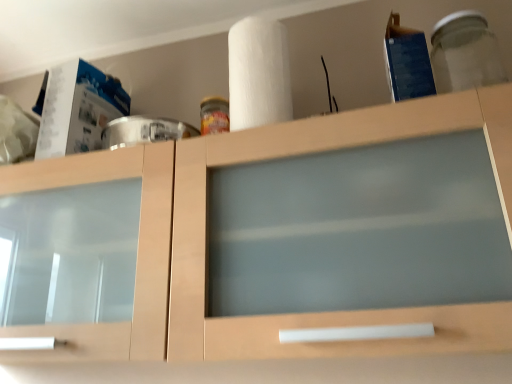
This screenshot has width=512, height=384. What do you see at coordinates (258, 74) in the screenshot?
I see `white matte paper towel at upper center` at bounding box center [258, 74].

Describe the element at coordinates (270, 238) in the screenshot. I see `matte wood cabinet at center` at that location.

The height and width of the screenshot is (384, 512). What are the coordinates of `white matte paper towel at upper center` in the screenshot? It's located at (258, 74).

From the image's perspective, is matte wood cabinet at center located above white matte paper towel at upper center?

No, from the image's perspective, matte wood cabinet at center is not over white matte paper towel at upper center.

Does point (158, 315) lie behind point (260, 87)?

No, it is not.

Is matte wood cabinet at center thinner than white matte paper towel at upper center?

No, matte wood cabinet at center is not thinner than white matte paper towel at upper center.

From a real-world perspective, which object stands above the other?

white matte paper towel at upper center, from a real-world perspective.

Measure the distance between white matte paper towel at upper center and matte wood cabinet at center.

white matte paper towel at upper center is 10.38 inches from matte wood cabinet at center.

Based on the photo, considering the sizes of objects white matte paper towel at upper center and matte wood cabinet at center in the image provided, who is bigger, white matte paper towel at upper center or matte wood cabinet at center?

matte wood cabinet at center.

Which of these two, white matte paper towel at upper center or matte wood cabinet at center, stands taller?

matte wood cabinet at center.

How many degrees apart are the facing directions of white matte paper towel at upper center and transparent glass jar at upper right?

The angular difference between white matte paper towel at upper center and transparent glass jar at upper right is 0.0031 degrees.

Would you say white matte paper towel at upper center is a long distance from transparent glass jar at upper right?

white matte paper towel at upper center is near transparent glass jar at upper right, not far away.

Which of these two, white matte paper towel at upper center or transparent glass jar at upper right, stands taller?

white matte paper towel at upper center is taller.

From the image's perspective, is white matte paper towel at upper center located above transparent glass jar at upper right?

Incorrect, from the image's perspective, white matte paper towel at upper center is lower than transparent glass jar at upper right.

Who is smaller, transparent glass jar at upper right or matte wood cabinet at center?

transparent glass jar at upper right.

Is point (481, 41) positioned behind point (226, 312)?

Yes.

Is transparent glass jar at upper right looking in the opposite direction of matte wood cabinet at center?

No, transparent glass jar at upper right's orientation is not away from matte wood cabinet at center.

Image resolution: width=512 pixels, height=384 pixels. In order to click on glass jar on the right of matte wood cabinet at center in this screenshot , I will do `click(465, 53)`.

Is there a large distance between matte wood cabinet at center and transparent glass jar at upper right?

No, matte wood cabinet at center is not far from transparent glass jar at upper right.

Does point (96, 270) come closer to viewer compared to point (454, 23)?

Yes, it is in front of point (454, 23).

Is transparent glass jar at upper right bigger or smaller than white matte paper towel at upper center?

Clearly, transparent glass jar at upper right is smaller in size than white matte paper towel at upper center.

Is the position of transparent glass jar at upper right less distant than that of white matte paper towel at upper center?

Yes, transparent glass jar at upper right is in front of white matte paper towel at upper center.

Which object is positioned more to the left, transparent glass jar at upper right or white matte paper towel at upper center?

Positioned to the left is white matte paper towel at upper center.

At what (x,y) coordinates should I click in order to perform the action: click on paper towel that appears above the matte wood cabinet at center (from the image's perspective). Please return your answer as a coordinate pair (x, y). The height and width of the screenshot is (384, 512). Looking at the image, I should click on (258, 74).

Identify the location of cabinetry in front of the white matte paper towel at upper center. (270, 238).

Based on the photo, estimate the real-world distances between objects in this image. Which object is closer to white matte paper towel at upper center, transparent glass jar at upper right or matte wood cabinet at center?

The object closer to white matte paper towel at upper center is matte wood cabinet at center.

When comparing their distances from matte wood cabinet at center, does white matte paper towel at upper center or transparent glass jar at upper right seem further?

transparent glass jar at upper right lies further to matte wood cabinet at center than the other object.

When comparing their distances from matte wood cabinet at center, does transparent glass jar at upper right or white matte paper towel at upper center seem closer?

white matte paper towel at upper center.

From the picture: Looking at the image, which one is located closer to transparent glass jar at upper right, white matte paper towel at upper center or matte wood cabinet at center?

white matte paper towel at upper center is closer to transparent glass jar at upper right.

When comparing their distances from transparent glass jar at upper right, does matte wood cabinet at center or white matte paper towel at upper center seem further?

matte wood cabinet at center is positioned further to the anchor transparent glass jar at upper right.

Estimate the real-world distances between objects in this image. Which object is closer to white matte paper towel at upper center, matte wood cabinet at center or transparent glass jar at upper right?

Among the two, matte wood cabinet at center is located nearer to white matte paper towel at upper center.

Locate an element on the screen. The width and height of the screenshot is (512, 384). paper towel between matte wood cabinet at center and transparent glass jar at upper right in the horizontal direction is located at coordinates (258, 74).